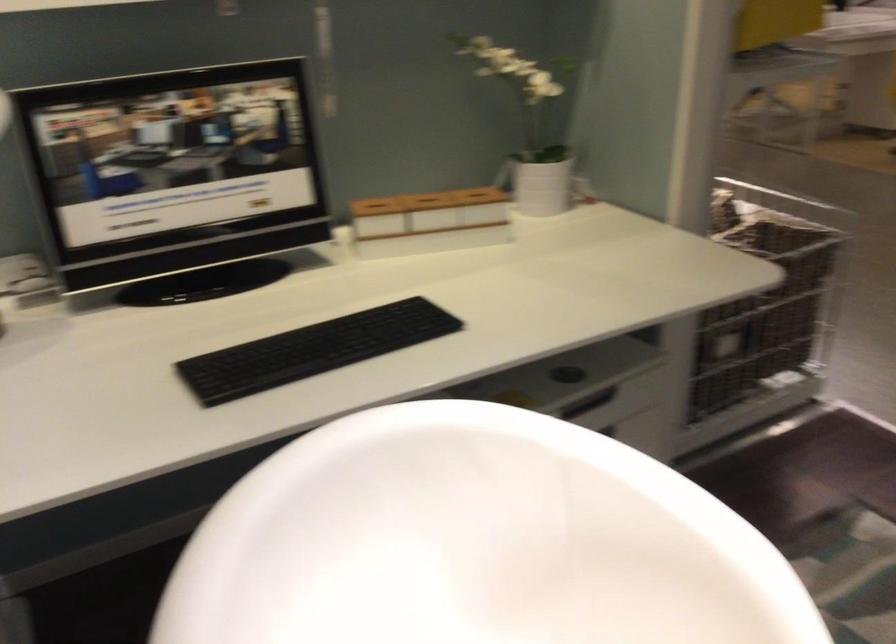
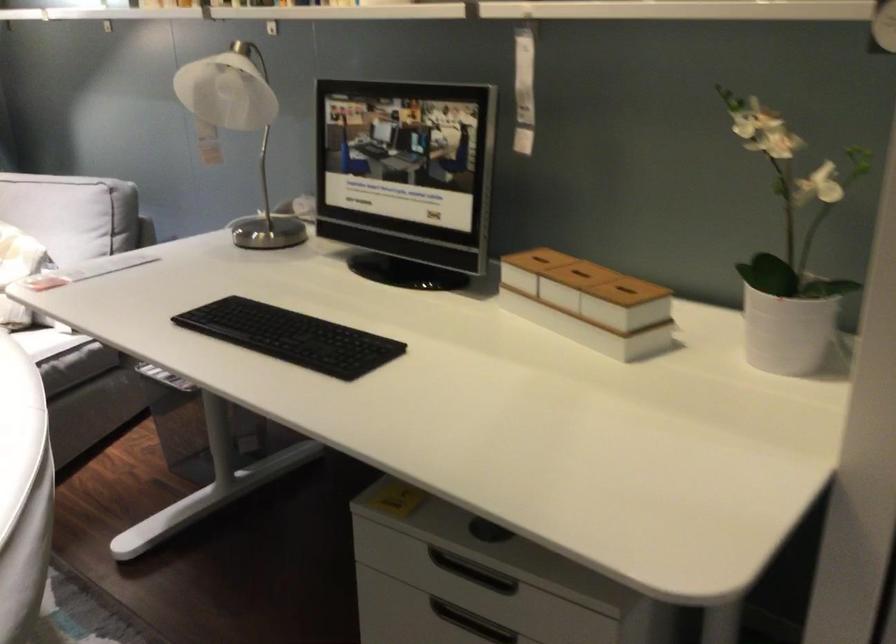
Where in the second image is the point corresponding to pixel 578 180 from the first image?

(787, 332)